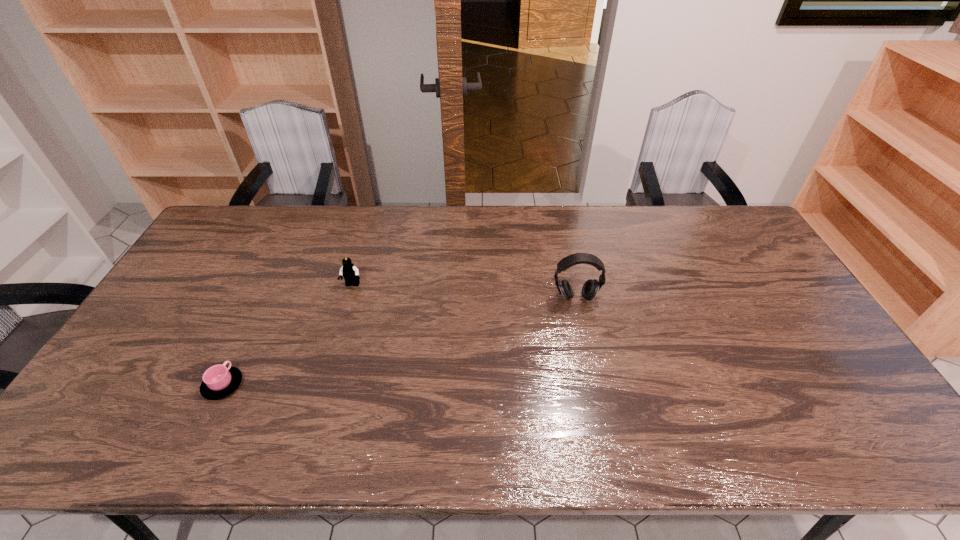
The height and width of the screenshot is (540, 960). I want to click on free spot between the Lego and the shortest object, so click(288, 335).

The image size is (960, 540). In order to click on free spot between the second object from left to right and the tallest object in this screenshot , I will do `click(464, 292)`.

Image resolution: width=960 pixels, height=540 pixels. In order to click on free point between the earphone and the shortest object in this screenshot , I will do `click(399, 341)`.

Locate an element on the screen. The image size is (960, 540). free space between the earphone and the second object from left to right is located at coordinates (464, 292).

At what (x,y) coordinates should I click in order to perform the action: click on free space between the rightmost object and the second tallest object. Please return your answer as a coordinate pair (x, y). This screenshot has width=960, height=540. Looking at the image, I should click on (464, 292).

You are a GUI agent. You are given a task and a screenshot of the screen. Output one action in this format:
    pyautogui.click(x=<x>, y=<y>)
    Task: Click on the unoccupied area between the Lego and the cup
    The image size is (960, 540).
    Given the screenshot: What is the action you would take?
    pyautogui.click(x=288, y=335)

You are a GUI agent. You are given a task and a screenshot of the screen. Output one action in this format:
    pyautogui.click(x=<x>, y=<y>)
    Task: Click on the object that is the closest to the tallest object
    
    Given the screenshot: What is the action you would take?
    pyautogui.click(x=350, y=273)

The height and width of the screenshot is (540, 960). I want to click on object that stands as the second closest to the second object from left to right, so click(x=590, y=288).